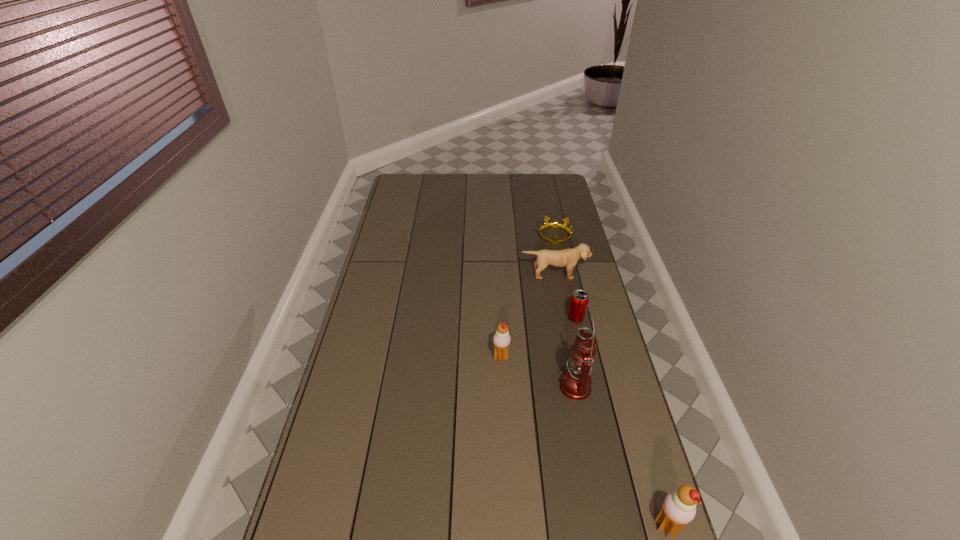
Identify the location of soda can situated at the right edge. (579, 301).

In the image, there is a desktop. Where is `vacant space at the far edge`? The height and width of the screenshot is (540, 960). vacant space at the far edge is located at coordinates (487, 185).

Where is `vacant space at the near edge of the desktop`? This screenshot has width=960, height=540. vacant space at the near edge of the desktop is located at coordinates (518, 536).

Find the location of a particular element. free space at the left edge of the desktop is located at coordinates (361, 319).

In the image, there is a desktop. At what (x,y) coordinates should I click in order to perform the action: click on free space at the right edge. Please return your answer as a coordinate pair (x, y). Looking at the image, I should click on (563, 207).

Locate an element on the screen. vacant space at the far left corner is located at coordinates (404, 177).

This screenshot has height=540, width=960. I want to click on free space at the near left corner of the desktop, so click(313, 520).

The image size is (960, 540). Find the location of `free space between the puppy and the shorter icecream`. free space between the puppy and the shorter icecream is located at coordinates point(528,316).

Identify the location of free point between the shortest object and the left icecream. The image size is (960, 540). (528, 297).

You are a GUI agent. You are given a task and a screenshot of the screen. Output one action in this format:
    pyautogui.click(x=<x>, y=<y>)
    Task: Click on the free space between the shortest object and the second nearest object
    The image size is (960, 540).
    Given the screenshot: What is the action you would take?
    pyautogui.click(x=564, y=311)